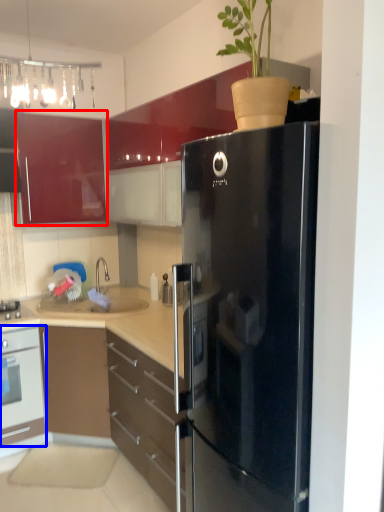
Question: Which object is closer to the camera taking this photo, cabinetry (highlighted by a red box) or oven (highlighted by a blue box)?

Choices:
 (A) cabinetry
 (B) oven

Answer: (B)